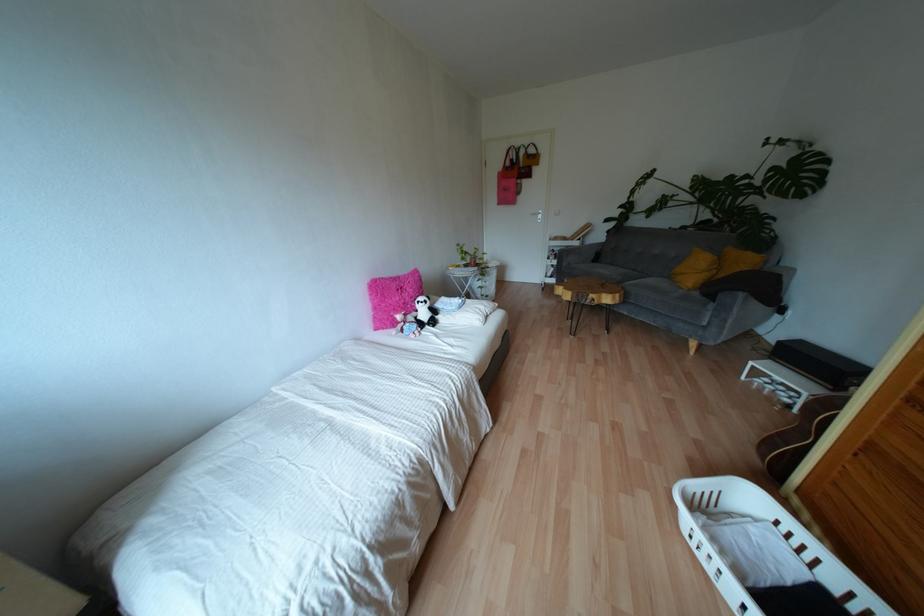
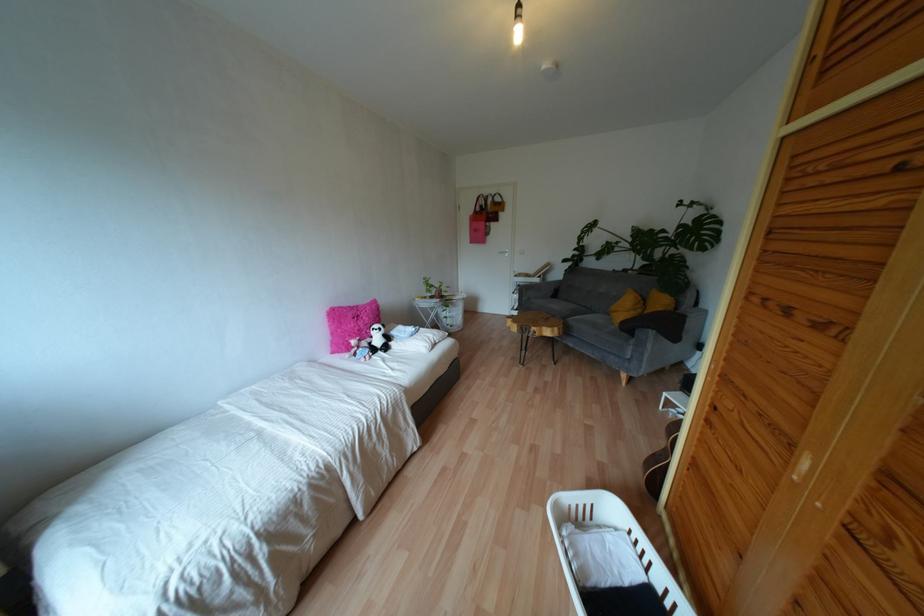
The point at (768, 442) is marked in the first image. Where is the corresponding point in the second image?

(648, 464)